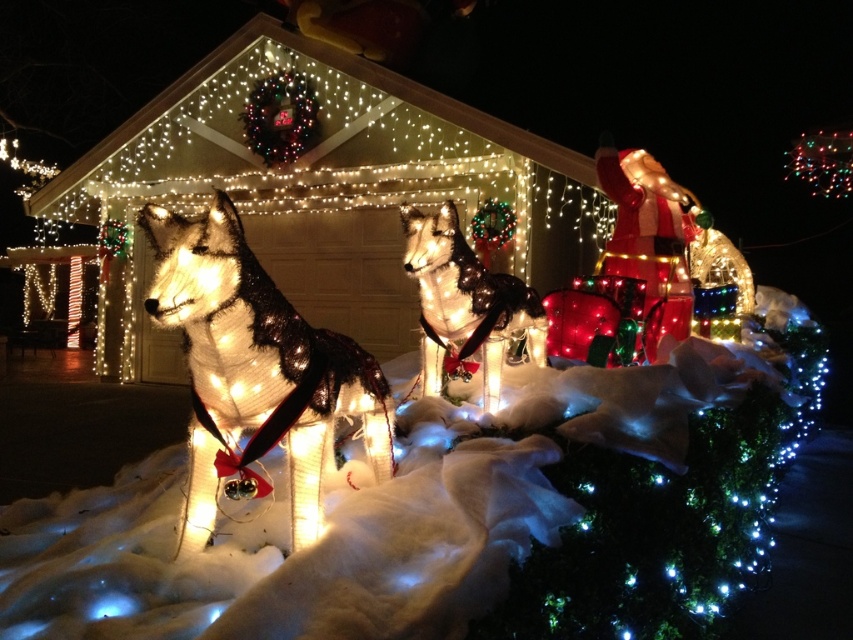
Is point (257, 572) more distant than point (479, 314)?

That is False.

Who is more forward, (369,566) or (440,358)?

Point (369,566) is in front.

The image size is (853, 640). I want to click on icy white snow at lower left, so click(456, 515).

Measure the distance between point (194, 324) and camera.

Point (194, 324) is 6.39 feet away from camera.

Does illuminated mesh dog at center appear over illuminated plastic dog at center?

Actually, illuminated mesh dog at center is below illuminated plastic dog at center.

Who is more forward, (196, 444) or (491, 360)?

Point (196, 444)

At what (x,y) coordinates should I click in order to perform the action: click on illuminated mesh dog at center. Please return your answer as a coordinate pair (x, y). The height and width of the screenshot is (640, 853). Looking at the image, I should click on pos(254,372).

Between icy white snow at lower left and illuminated mesh dog at center, which one is positioned lower?

icy white snow at lower left

This screenshot has width=853, height=640. Identify the location of icy white snow at lower left. (456, 515).

The width and height of the screenshot is (853, 640). I want to click on icy white snow at lower left, so click(456, 515).